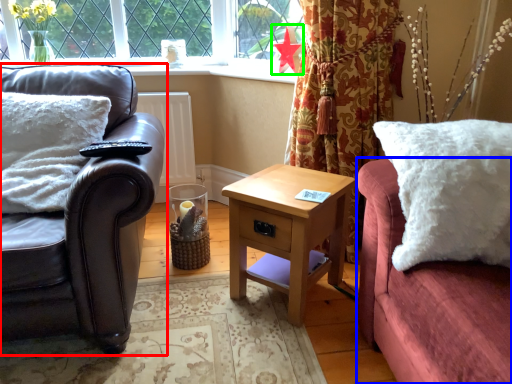
Question: Considering the real-world distances, which object is closest to studio couch (highlighted by a red box)? couch (highlighted by a blue box) or flower (highlighted by a green box).

Choices:
 (A) couch
 (B) flower

Answer: (A)